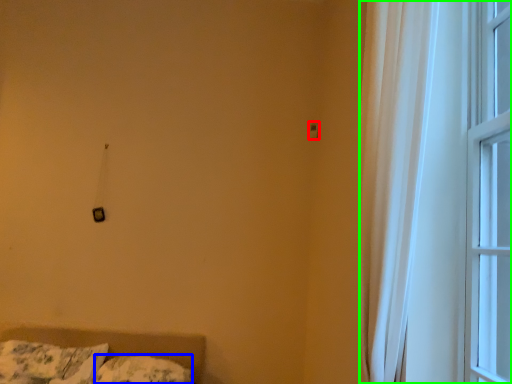
Question: Estimate the real-world distances between objects in this image. Which object is closer to light switch (highlighted by a red box), pillow (highlighted by a blue box) or window (highlighted by a green box)?

Choices:
 (A) pillow
 (B) window

Answer: (B)